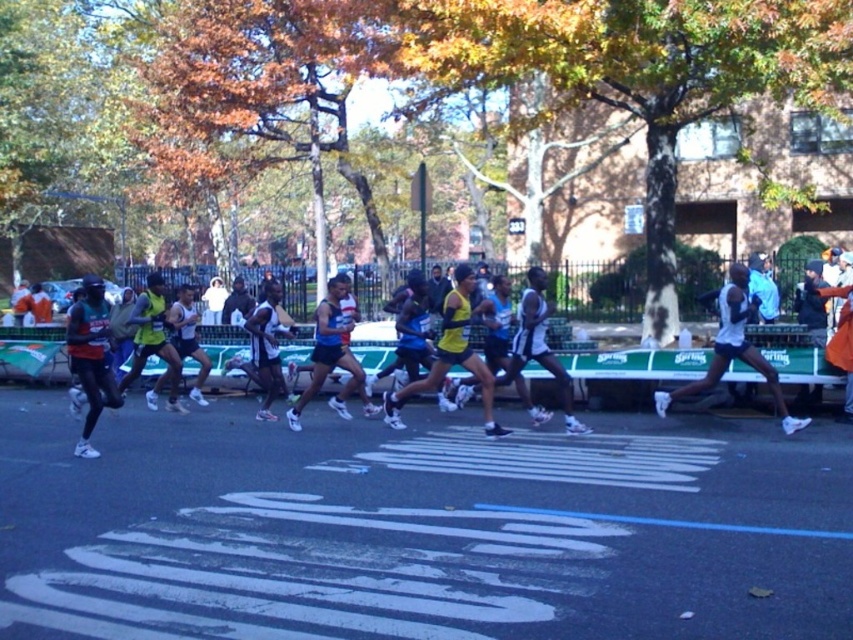
Question: Estimate the real-world distances between objects in this image. Which object is farther from the yellow fabric shorts at center?

Choices:
 (A) blue fabric shorts at center
 (B) matte yellow tank top at center

Answer: (B)

Question: Can you confirm if matte black running shoe at left is positioned above matte yellow tank top at center?

Choices:
 (A) yes
 (B) no

Answer: (A)

Question: Does yellow matte shorts at center have a lesser width compared to matte yellow tank top at center?

Choices:
 (A) yes
 (B) no

Answer: (B)

Question: Estimate the real-world distances between objects in this image. Which object is closer to the matte yellow tank top at center?

Choices:
 (A) blue fabric shorts at center
 (B) matte black running shoe at left

Answer: (B)

Question: Based on their relative distances, which object is farther from the black athletic wear at center?

Choices:
 (A) matte yellow tank top at center
 (B) white matte running shoe at right

Answer: (B)

Question: Does matte black running shoe at left have a greater width compared to matte yellow tank top at center?

Choices:
 (A) yes
 (B) no

Answer: (A)